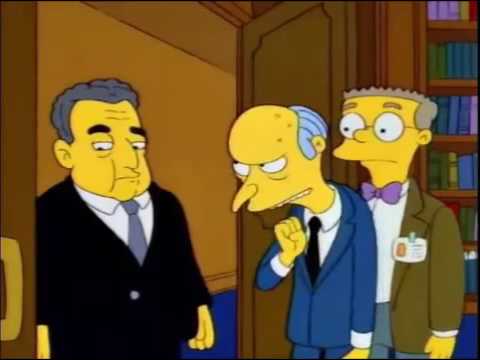
Where is `blue books`? This screenshot has width=480, height=360. blue books is located at coordinates (466, 61), (455, 122), (458, 53), (465, 165), (474, 269).